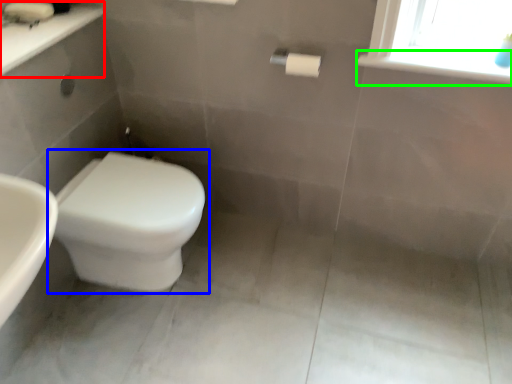
Question: Which is farther away from counter top (highlighted by a red box)? toilet (highlighted by a blue box) or window sill (highlighted by a green box)?

Choices:
 (A) toilet
 (B) window sill

Answer: (B)